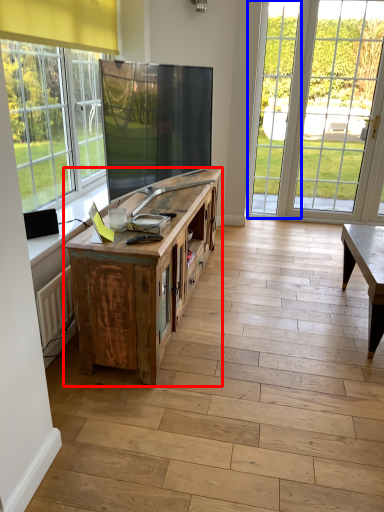
Question: Which point is further to the camera, cabinetry (highlighted by a red box) or glass door (highlighted by a blue box)?

Choices:
 (A) cabinetry
 (B) glass door

Answer: (B)